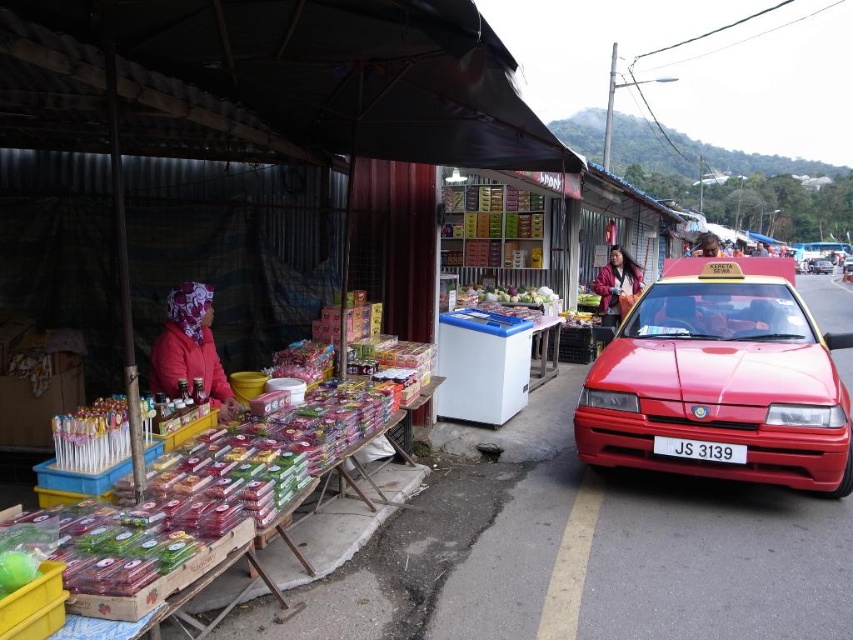
Question: Which of these objects is positioned closest to the floral fabric headscarf at left?

Choices:
 (A) red matte taxi at right
 (B) red glossy taxi at right

Answer: (B)

Question: From the image, what is the correct spatial relationship of floral fabric headscarf at left in relation to leather jacket at upper right?

Choices:
 (A) left
 (B) right

Answer: (A)

Question: Does white plastic license plate at center come behind red matte taxi at right?

Choices:
 (A) yes
 (B) no

Answer: (B)

Question: Does red glossy taxi at right appear under leather jacket at upper right?

Choices:
 (A) no
 (B) yes

Answer: (B)

Question: Which point is farther to the camera?

Choices:
 (A) (599, 296)
 (B) (822, 260)

Answer: (B)

Question: Which object appears farthest from the camera in this image?

Choices:
 (A) red matte taxi at right
 (B) white plastic license plate at center
 (C) floral fabric headscarf at left
 (D) leather jacket at upper right

Answer: (A)